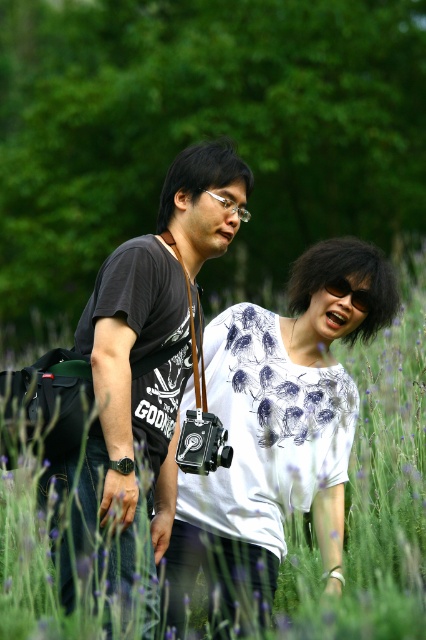
Identify the location of black matte sunglasses at center. (350, 292).

Does black matte sunglasses at center have a smaller size compared to clear plastic glasses at center?

Yes.

At what (x,y) coordinates should I click in order to perform the action: click on black matte sunglasses at center. Please return your answer as a coordinate pair (x, y). The height and width of the screenshot is (640, 426). Looking at the image, I should click on (350, 292).

Identify the location of black matte sunglasses at center. This screenshot has height=640, width=426. pyautogui.click(x=350, y=292).

Can you confirm if white printed shirt at center is positioned to the right of black matte camera at center?

Yes, white printed shirt at center is to the right of black matte camera at center.

Is white printed shirt at center wider than black matte camera at center?

Indeed, white printed shirt at center has a greater width compared to black matte camera at center.

Based on the photo, who is more forward, (x=190, y=490) or (x=115, y=483)?

Point (x=115, y=483) is in front.

Where is `white printed shirt at center`? This screenshot has height=640, width=426. white printed shirt at center is located at coordinates click(276, 429).

Who is taller, white printed shirt at center or black matte sunglasses at center?

white printed shirt at center is taller.

Does white printed shirt at center lie behind black matte sunglasses at center?

No, it is not.

Is point (241, 438) behind point (336, 292)?

That is False.

At what (x,y) coordinates should I click in order to perform the action: click on white printed shirt at center. Please return your answer as a coordinate pair (x, y). The image size is (426, 640). Looking at the image, I should click on (276, 429).